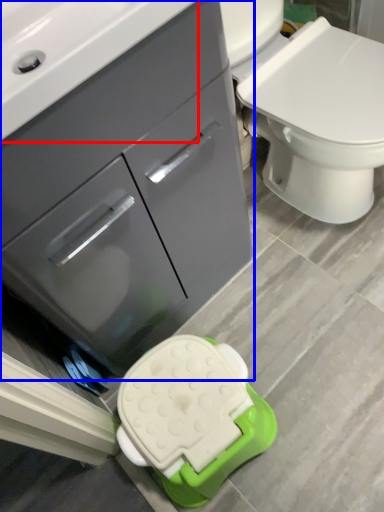
Question: Which object appears closest to the camera in this image, sink (highlighted by a red box) or bathroom cabinet (highlighted by a blue box)?

Choices:
 (A) sink
 (B) bathroom cabinet

Answer: (A)